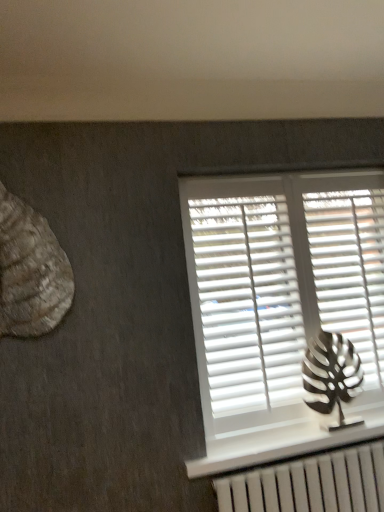
Question: Is metallic silver leaf at right, placed as the second animal when sorted from top to bottom, to the left or to the right of white matte shutter at right, marked as the 2th shutter in a left-to-right arrangement, in the image?

Choices:
 (A) left
 (B) right

Answer: (A)

Question: Is point (337, 424) closer or farther from the camera than point (367, 252)?

Choices:
 (A) closer
 (B) farther

Answer: (A)

Question: Estimate the real-world distances between objects in this image. Which object is farther from the metallic silver leaf at right, marked as the first animal in a back-to-front arrangement?

Choices:
 (A) white matte shutter at right, marked as the 2th shutter in a left-to-right arrangement
 (B) rustic wood seashell at left, placed as the 1th animal when sorted from front to back
 (C) white matte blinds at upper right
 (D) white plastic shutters at center, which ranks as the first shutter in left-to-right order

Answer: (B)

Question: Based on their relative distances, which object is farther from the metallic silver leaf at right, which appears as the 2th animal when viewed from the left?

Choices:
 (A) white matte shutter at right, marked as the 2th shutter in a left-to-right arrangement
 (B) white plastic shutters at center, which ranks as the 2th shutter in right-to-left order
 (C) rustic wood seashell at left, which is counted as the second animal, starting from the bottom
 (D) white matte blinds at upper right

Answer: (C)